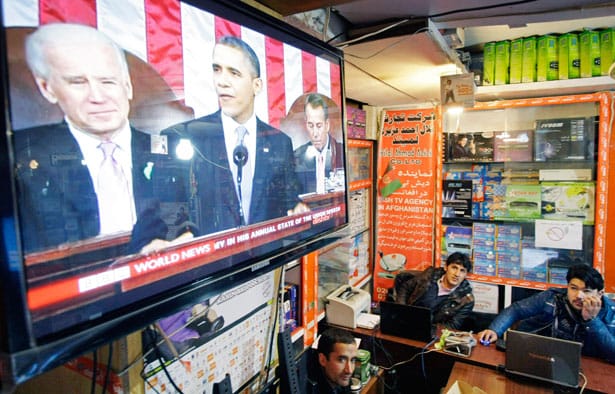
Identify the location of light bult. This screenshot has width=615, height=394. [187, 143].